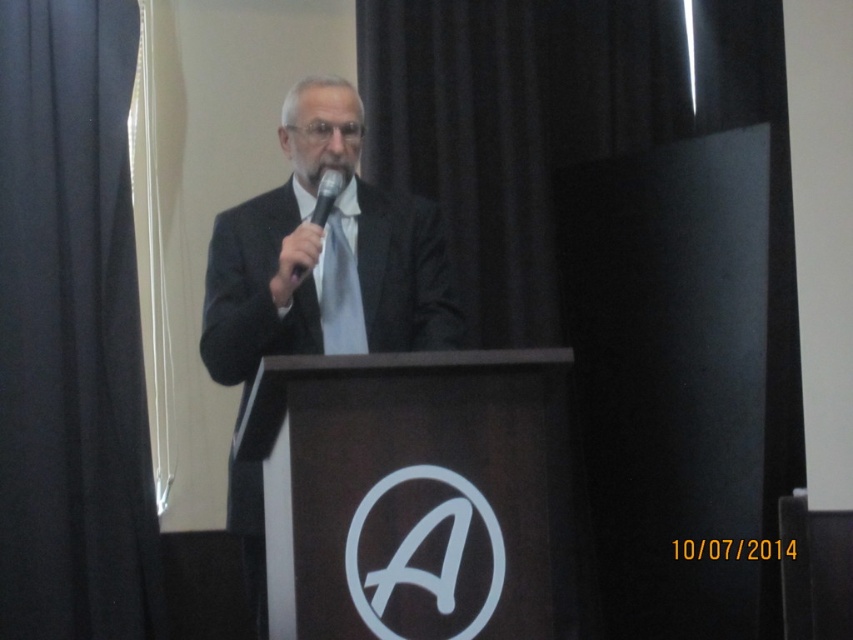
Question: Where is black suit at center located in relation to black matte microphone at center in the image?

Choices:
 (A) above
 (B) below

Answer: (B)

Question: Can you confirm if black fabric curtain at left is positioned to the left of gray matte beard at center?

Choices:
 (A) yes
 (B) no

Answer: (A)

Question: Which object is the closest to the black matte microphone at center?

Choices:
 (A) silky white tie at center
 (B) gray matte beard at center
 (C) black matte curtain at upper left
 (D) black suit at center

Answer: (B)

Question: Which point is farther from the camera taking this photo?

Choices:
 (A) (57, 628)
 (B) (332, 176)
 (C) (682, 454)
 (D) (354, 160)

Answer: (C)

Question: Estimate the real-world distances between objects in this image. Which object is closer to the gray matte beard at center?

Choices:
 (A) black matte curtain at upper left
 (B) black suit at center

Answer: (B)

Question: In this image, where is gray matte beard at center located relative to black matte microphone at center?

Choices:
 (A) below
 (B) above

Answer: (B)